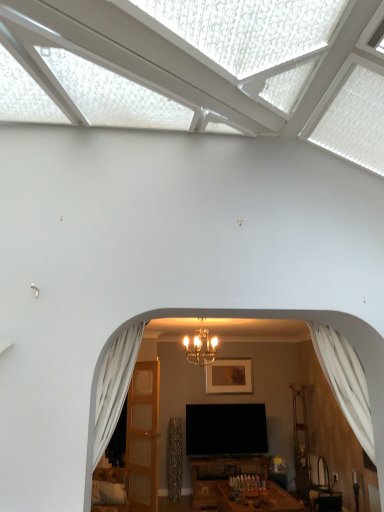
Where is `white sheer curtain at left, positioned as the 1th curtain in left-to-right order`? This screenshot has height=512, width=384. white sheer curtain at left, positioned as the 1th curtain in left-to-right order is located at coordinates (114, 386).

Image resolution: width=384 pixels, height=512 pixels. What do you see at coordinates (345, 381) in the screenshot? I see `white sheer curtain at right, placed as the 2th curtain when sorted from left to right` at bounding box center [345, 381].

This screenshot has height=512, width=384. In order to click on matte gold picture frame at center in this screenshot , I will do `click(229, 376)`.

You are a GUI agent. You are given a task and a screenshot of the screen. Output one action in this format:
    pyautogui.click(x=<x>, y=<y>)
    Task: Click on the white sheer curtain at left, positioned as the 1th curtain in left-to-right order
    This screenshot has height=512, width=384.
    Given the screenshot: What is the action you would take?
    pyautogui.click(x=114, y=386)

You are a GUI agent. You are given a task and a screenshot of the screen. Output one action in this format:
    pyautogui.click(x=<x>, y=<y>)
    Task: Click on the door that appears behind the metallic chandelier at center
    
    Given the screenshot: What is the action you would take?
    (x=143, y=436)

From a real-world perspective, between metallic chandelier at center and light brown wooden door at center, who is vertically higher?

metallic chandelier at center, from a real-world perspective.

Which point is more forward, (199, 332) or (151, 361)?

Point (199, 332)

Is light brown wooden door at center at the back of metallic chandelier at center?

No.

Is white sheer curtain at right, the first curtain viewed from the right, in front of light brown wooden door at center?

Yes, white sheer curtain at right, the first curtain viewed from the right, is in front of light brown wooden door at center.

The height and width of the screenshot is (512, 384). I want to click on curtain that is the 2nd one when counting rightward from the light brown wooden door at center, so click(345, 381).

Is white sheer curtain at right, the first curtain viewed from the right, bigger or smaller than light brown wooden door at center?

Clearly, white sheer curtain at right, the first curtain viewed from the right, is smaller in size than light brown wooden door at center.

Is white sheer curtain at right, the first curtain viewed from the right, wider or thinner than light brown wooden door at center?

Clearly, white sheer curtain at right, the first curtain viewed from the right, has more width compared to light brown wooden door at center.

Is metallic chandelier at center positioned behind matte gold picture frame at center?

That is False.

Is metallic chandelier at center completely or partially outside of matte gold picture frame at center?

Yes, metallic chandelier at center is located beyond the bounds of matte gold picture frame at center.

From the image's perspective, is metallic chandelier at center positioned above or below matte gold picture frame at center?

From the image's perspective, metallic chandelier at center appears above matte gold picture frame at center.

Which of these two, metallic chandelier at center or matte gold picture frame at center, stands taller?

matte gold picture frame at center is taller.

Is white sheer curtain at left, positioned as the 1th curtain in left-to-right order, in contact with matte gold picture frame at center?

No, white sheer curtain at left, positioned as the 1th curtain in left-to-right order, is not beside matte gold picture frame at center.

From the picture: Is white sheer curtain at left, arranged as the second curtain when viewed from the right, not within matte gold picture frame at center?

Yes.

Is white sheer curtain at left, positioned as the 1th curtain in left-to-right order, shorter than matte gold picture frame at center?

No, white sheer curtain at left, positioned as the 1th curtain in left-to-right order, is not shorter than matte gold picture frame at center.

Is matte gold picture frame at center not within white sheer curtain at left, positioned as the 1th curtain in left-to-right order?

Yes, matte gold picture frame at center is outside of white sheer curtain at left, positioned as the 1th curtain in left-to-right order.

I want to click on the 2nd curtain in front of the matte gold picture frame at center, so tap(114, 386).

Is point (223, 391) closer or farther from the camera than point (129, 381)?

Point (223, 391) is farther from the camera than point (129, 381).

Can you confirm if matte gold picture frame at center is taller than white sheer curtain at left, positioned as the 1th curtain in left-to-right order?

No.

How different are the orientations of light brown wooden door at center and white sheer curtain at left, arranged as the second curtain when viewed from the right, in degrees?

The facing directions of light brown wooden door at center and white sheer curtain at left, arranged as the second curtain when viewed from the right, are 123 degrees apart.

From a real-world perspective, is light brown wooden door at center physically located above or below white sheer curtain at left, arranged as the second curtain when viewed from the right?

In terms of real-world spatial position, light brown wooden door at center is below white sheer curtain at left, arranged as the second curtain when viewed from the right.

Is light brown wooden door at center wider or thinner than white sheer curtain at left, arranged as the second curtain when viewed from the right?

Considering their sizes, light brown wooden door at center looks slimmer than white sheer curtain at left, arranged as the second curtain when viewed from the right.

Is matte gold picture frame at center not inside light brown wooden door at center?

Indeed, matte gold picture frame at center is completely outside light brown wooden door at center.

Can you confirm if matte gold picture frame at center is smaller than light brown wooden door at center?

Indeed, matte gold picture frame at center has a smaller size compared to light brown wooden door at center.

In the scene shown: Does matte gold picture frame at center appear on the left side of light brown wooden door at center?

No.

I want to click on light fixture located on the right of light brown wooden door at center, so click(x=201, y=347).

Find the location of a particular element. The width and height of the screenshot is (384, 512). the 1st curtain positioned above the light brown wooden door at center (from a real-world perspective) is located at coordinates (345, 381).

Considering their positions, is white sheer curtain at right, placed as the 2th curtain when sorted from left to right, positioned further to metallic chandelier at center than light brown wooden door at center?

white sheer curtain at right, placed as the 2th curtain when sorted from left to right, lies further to metallic chandelier at center than the other object.

When comparing their distances from metallic chandelier at center, does white sheer curtain at left, positioned as the 1th curtain in left-to-right order, or matte gold picture frame at center seem further?

white sheer curtain at left, positioned as the 1th curtain in left-to-right order.

Which object lies nearer to the anchor point light brown wooden door at center, white sheer curtain at right, the first curtain viewed from the right, or matte gold picture frame at center?

matte gold picture frame at center lies closer to light brown wooden door at center than the other object.

Looking at the image, which one is located further to white sheer curtain at left, arranged as the second curtain when viewed from the right, light brown wooden door at center or white sheer curtain at right, the first curtain viewed from the right?

light brown wooden door at center is positioned further to the anchor white sheer curtain at left, arranged as the second curtain when viewed from the right.

Looking at this image, from the image, which object appears to be farther from metallic chandelier at center, white sheer curtain at right, placed as the 2th curtain when sorted from left to right, or white sheer curtain at left, positioned as the 1th curtain in left-to-right order?

The object further to metallic chandelier at center is white sheer curtain at left, positioned as the 1th curtain in left-to-right order.

Considering their positions, is metallic chandelier at center positioned further to white sheer curtain at left, positioned as the 1th curtain in left-to-right order, than matte gold picture frame at center?

Among the two, matte gold picture frame at center is located further to white sheer curtain at left, positioned as the 1th curtain in left-to-right order.

From the image, which object appears to be nearer to white sheer curtain at right, the first curtain viewed from the right, metallic chandelier at center or light brown wooden door at center?

metallic chandelier at center lies closer to white sheer curtain at right, the first curtain viewed from the right, than the other object.

Which object lies nearer to the anchor point light brown wooden door at center, matte gold picture frame at center or metallic chandelier at center?

matte gold picture frame at center.

Where is `light fixture between white sheer curtain at right, placed as the 2th curtain when sorted from left to right, and light brown wooden door at center, along the z-axis`? The height and width of the screenshot is (512, 384). light fixture between white sheer curtain at right, placed as the 2th curtain when sorted from left to right, and light brown wooden door at center, along the z-axis is located at coordinates (201, 347).

The height and width of the screenshot is (512, 384). I want to click on door positioned between metallic chandelier at center and matte gold picture frame at center from near to far, so click(x=143, y=436).

Where is `curtain positioned between white sheer curtain at left, arranged as the second curtain when viewed from the right, and metallic chandelier at center from near to far`? Image resolution: width=384 pixels, height=512 pixels. curtain positioned between white sheer curtain at left, arranged as the second curtain when viewed from the right, and metallic chandelier at center from near to far is located at coordinates (345, 381).

The image size is (384, 512). I want to click on curtain between white sheer curtain at left, arranged as the second curtain when viewed from the right, and light brown wooden door at center in the front-back direction, so click(345, 381).